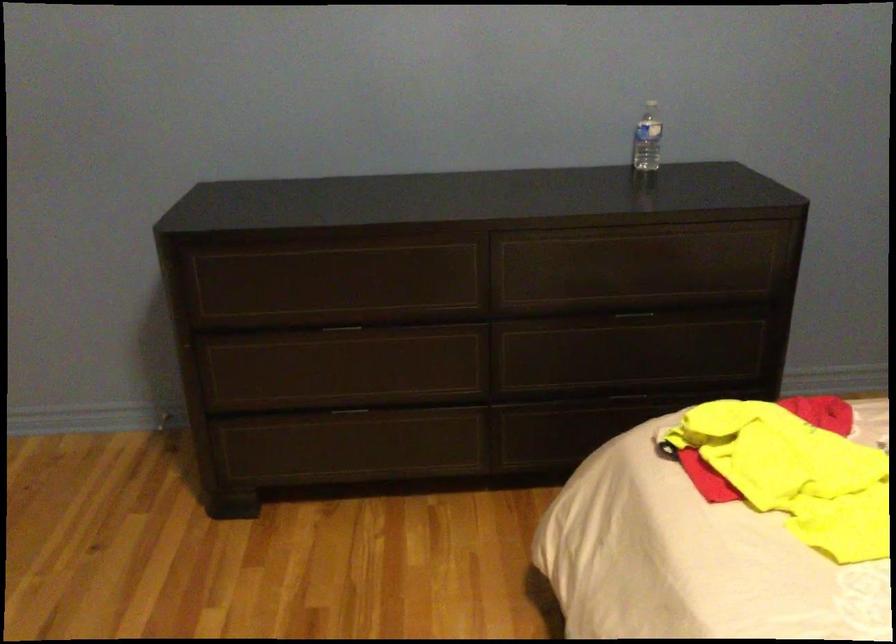
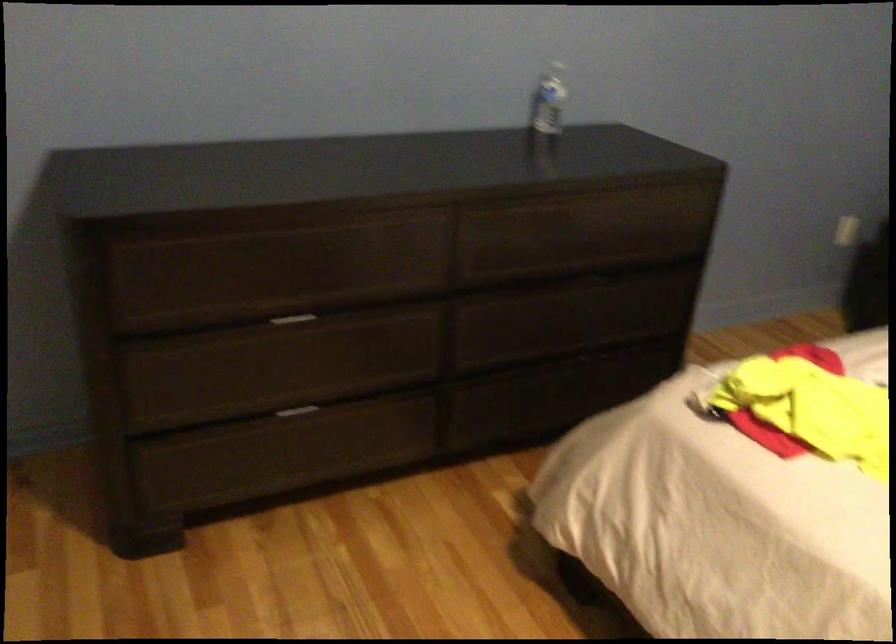
The images are taken continuously from a first-person perspective. In which direction are you moving?

The cameraman walked toward left, forward.